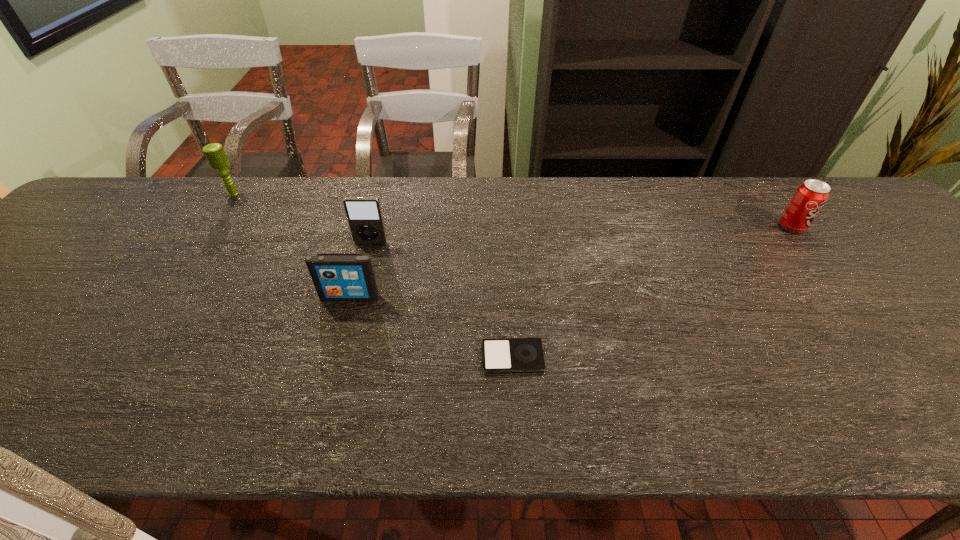
Select which iPod appears as the third closest to the leftmost object. Please provide its 2D coordinates. Your answer should be formatted as a tuple, i.e. [(x, y)], where the tuple contains the x and y coordinates of a point satisfying the conditions above.

[(502, 355)]

Identify which iPod is the nearest to the third nearest object. Please provide its 2D coordinates. Your answer should be formatted as a tuple, i.e. [(x, y)], where the tuple contains the x and y coordinates of a point satisfying the conditions above.

[(336, 276)]

You are a GUI agent. You are given a task and a screenshot of the screen. Output one action in this format:
    pyautogui.click(x=<x>, y=<y>)
    Task: Click on the vacant position in the image that satisfies the following two spatial constraints: 1. on the back side of the soda; 2. on the left side of the nearest object
    
    Given the screenshot: What is the action you would take?
    pyautogui.click(x=505, y=227)

Locate an element on the screen. The width and height of the screenshot is (960, 540). vacant space that satisfies the following two spatial constraints: 1. on the front-facing side of the rightmost iPod; 2. on the right side of the farthest iPod is located at coordinates (342, 357).

The width and height of the screenshot is (960, 540). Find the location of `blank area in the image that satisfies the following two spatial constraints: 1. on the front side of the soda; 2. on the left side of the leftmost object`. blank area in the image that satisfies the following two spatial constraints: 1. on the front side of the soda; 2. on the left side of the leftmost object is located at coordinates (213, 227).